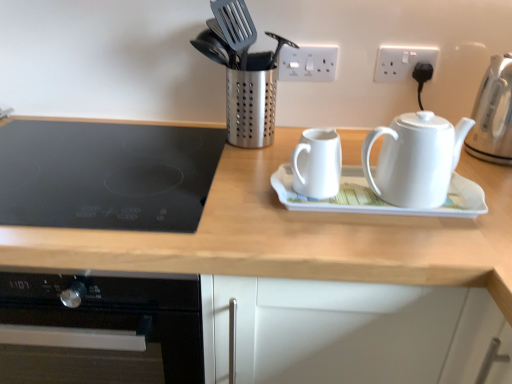
Where is `vacant region to the left of white ceramic saucer at center`? The image size is (512, 384). vacant region to the left of white ceramic saucer at center is located at coordinates (229, 196).